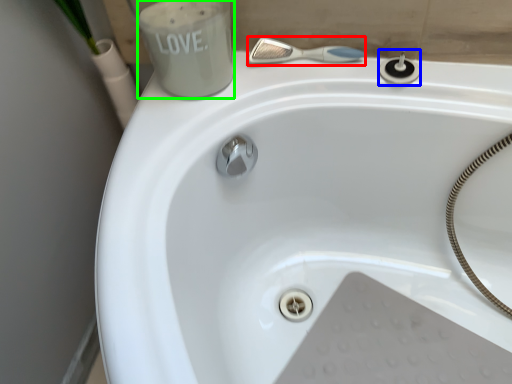
Question: Considering the real-world distances, which object is farthest from shower (highlighted by a red box)? plumbing fixture (highlighted by a blue box) or liquid (highlighted by a green box)?

Choices:
 (A) plumbing fixture
 (B) liquid

Answer: (B)